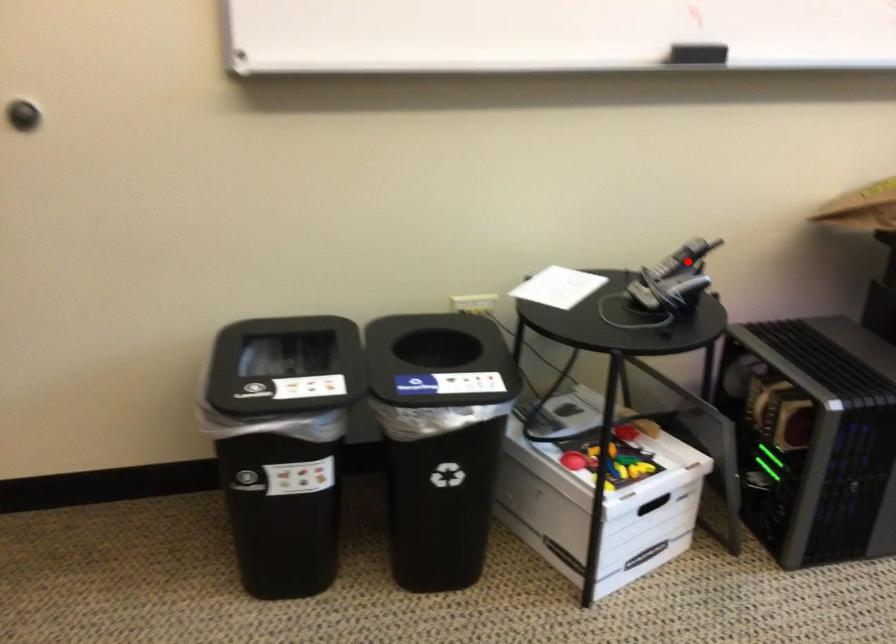
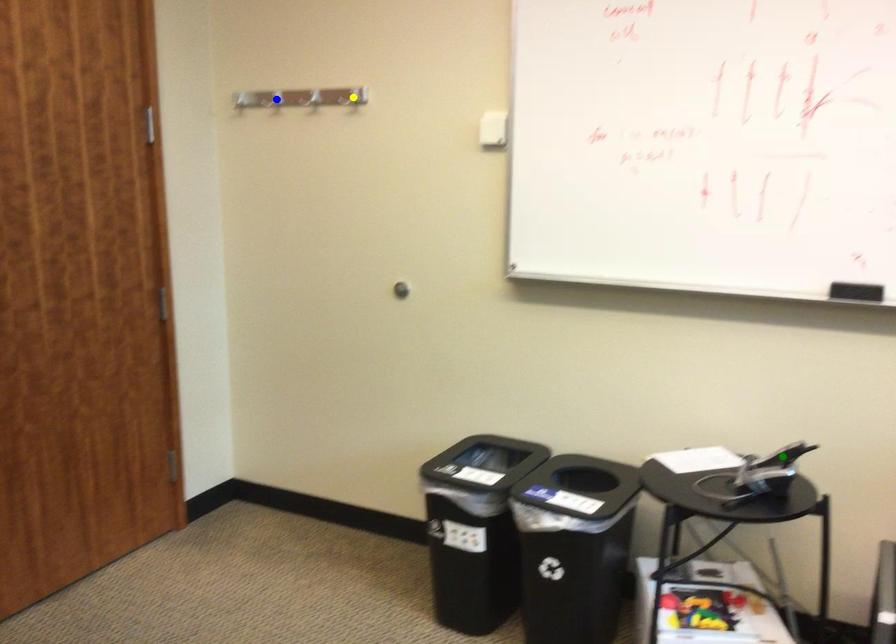
Question: I am providing you with two images of the same scene from different viewpoints. A red point is marked on the first image. You are given multiple points on the second image. Can you choose the point in image 2 that corresponds to the point in image 1?

Choices:
 (A) yellow point
 (B) green point
 (C) blue point

Answer: (B)